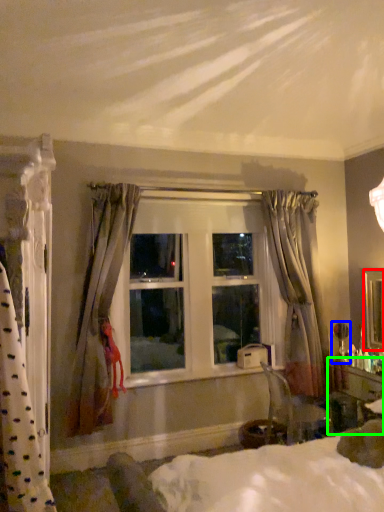
Question: Considering the real-world distances, which object is closest to mirror (highlighted by a red box)? table lamp (highlighted by a blue box) or vanity (highlighted by a green box).

Choices:
 (A) table lamp
 (B) vanity

Answer: (A)